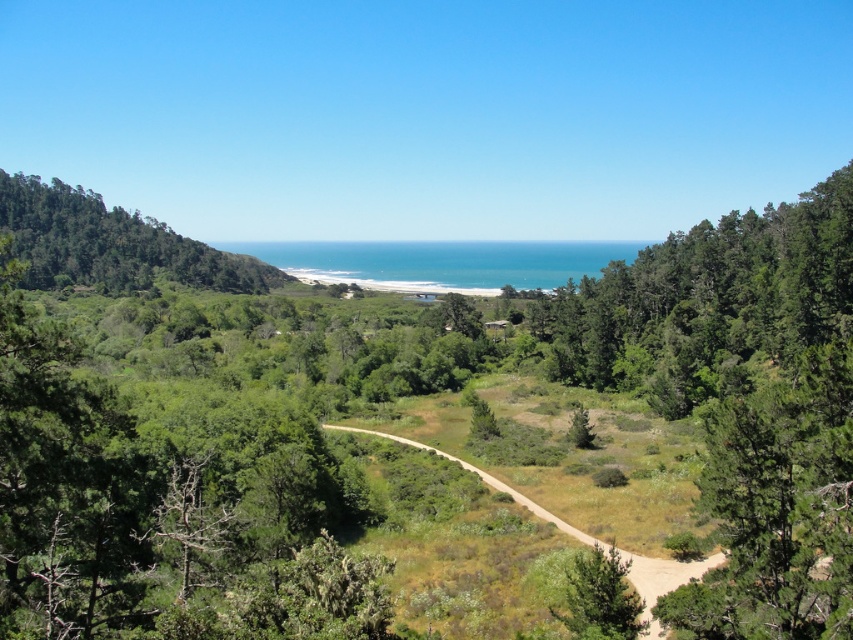
Between point (561, 372) and point (194, 257), which one is positioned in front?

Positioned in front is point (561, 372).

Does green leafy tree at center have a greater width compared to green leafy trees at left?

Yes, green leafy tree at center is wider than green leafy trees at left.

At what (x,y) coordinates should I click in order to perform the action: click on green leafy tree at center. Please return your answer as a coordinate pair (x, y). Looking at the image, I should click on (410, 449).

Who is higher up, green leafy tree at center or green matte tree at center?

Positioned higher is green leafy tree at center.

Does point (630, 301) lie in front of point (579, 612)?

That is False.

The height and width of the screenshot is (640, 853). What are the coordinates of `green leafy tree at center` in the screenshot? It's located at (410, 449).

Does point (3, 214) lie behind point (601, 570)?

Yes, it is.

Is point (26, 198) behind point (564, 616)?

Yes, it is.

I want to click on green leafy trees at left, so click(111, 243).